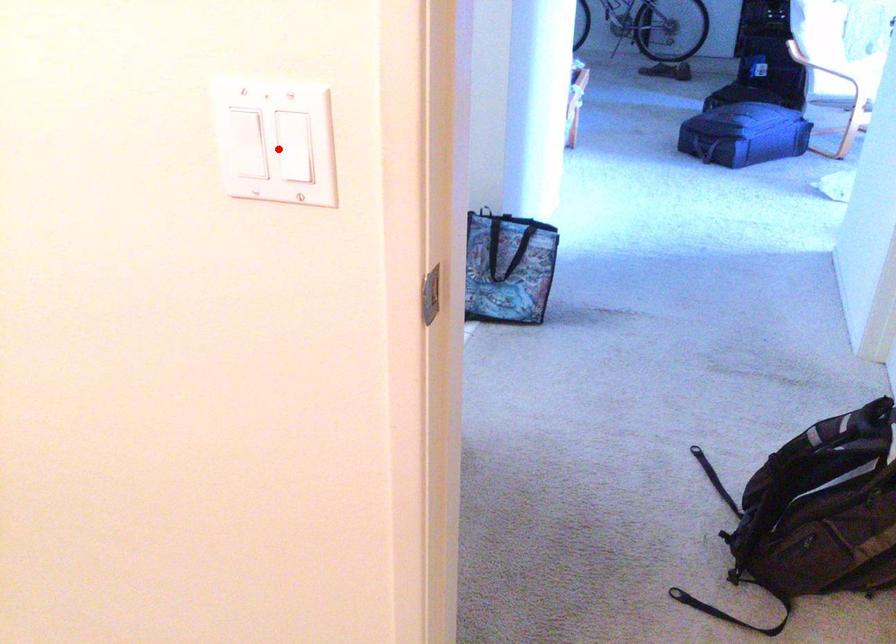
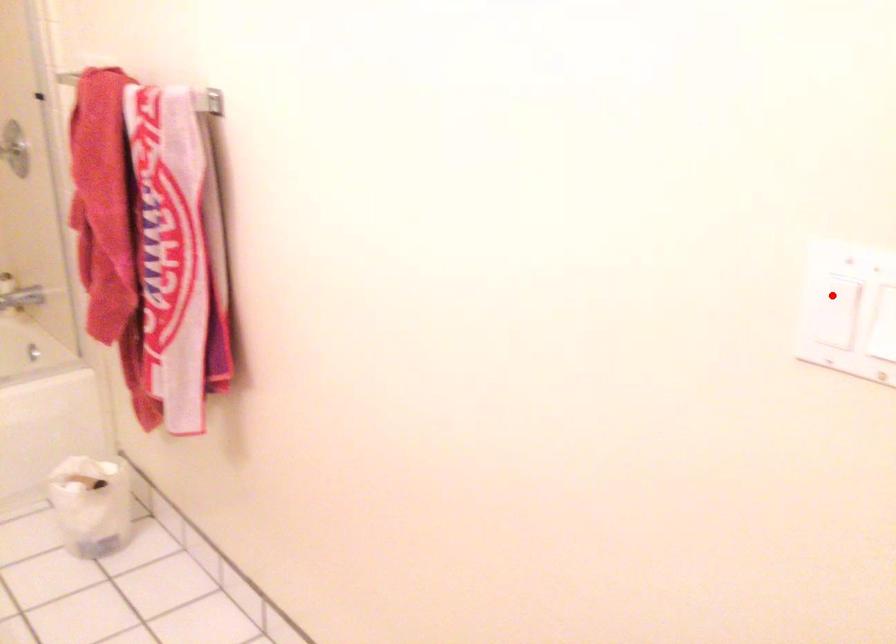
I am providing you with two images of the same scene from different viewpoints. A red point is marked on the first image and another point is marked on the second image. Do the highlighted points in image1 and image2 indicate the same real-world spot?

No